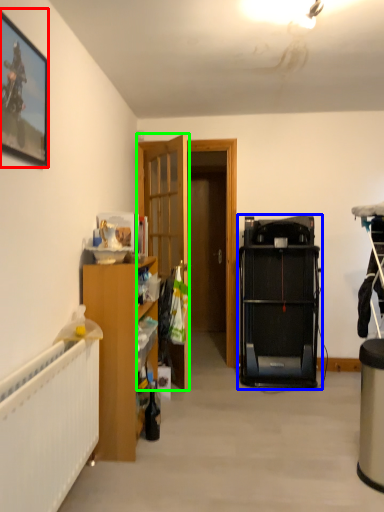
Question: Considering the real-world distances, which object is closest to picture frame (highlighted by a red box)? equipment (highlighted by a blue box) or door (highlighted by a green box).

Choices:
 (A) equipment
 (B) door

Answer: (B)